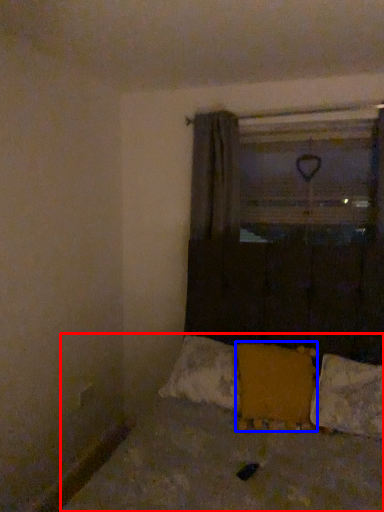
Question: Which of the following is the closest to the observer, bed (highlighted by a red box) or pillow (highlighted by a blue box)?

Choices:
 (A) bed
 (B) pillow

Answer: (A)